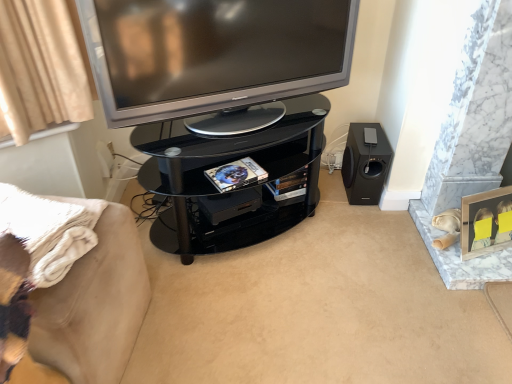
Image resolution: width=512 pixels, height=384 pixels. I want to click on free spot to the left of black matte speaker at lower right, so click(330, 188).